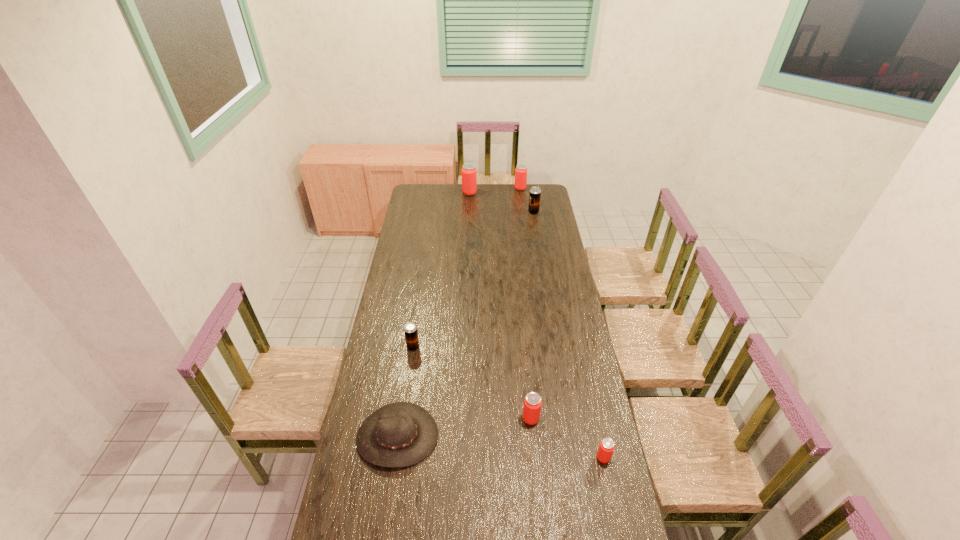
Locate an element on the screen. Image resolution: width=960 pixels, height=540 pixels. vacant area in the image that satisfies the following two spatial constraints: 1. on the back side of the leftmost red beer can; 2. on the right side of the second red beer can from right to left is located at coordinates (469, 189).

Locate an element on the screen. vacant region that satisfies the following two spatial constraints: 1. on the back side of the second red beer can from right to left; 2. on the left side of the second nearest beer can is located at coordinates (509, 189).